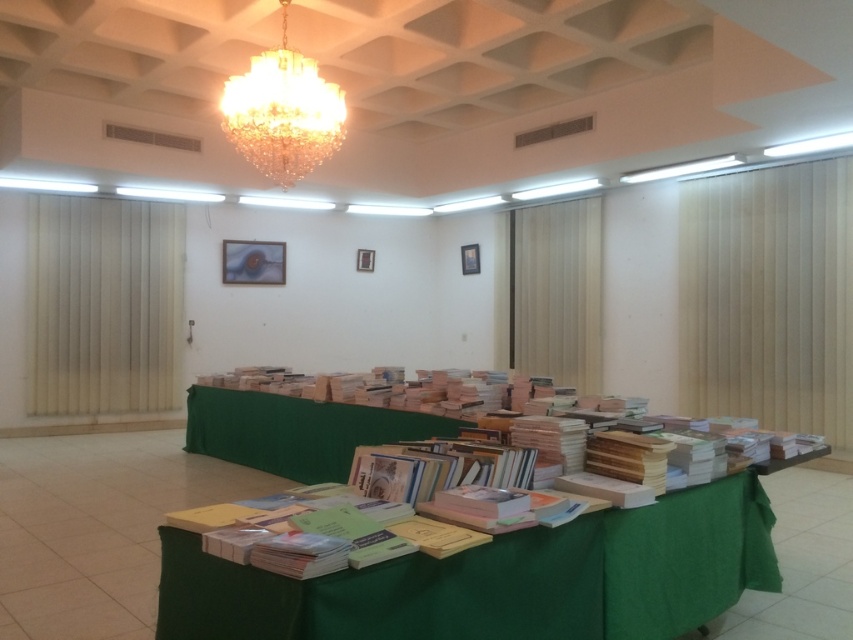
Is green fabric-covered table at center further to the viewer compared to beige fabric curtain at right?

No, it is not.

Who is lower down, green fabric-covered table at center or beige fabric curtain at right?

Positioned lower is green fabric-covered table at center.

Identify the location of green fabric-covered table at center. The height and width of the screenshot is (640, 853). (502, 579).

I want to click on green fabric-covered table at center, so click(502, 579).

Describe the element at coordinates (103, 305) in the screenshot. The height and width of the screenshot is (640, 853). I see `white/textured curtain at left` at that location.

Who is positioned more to the right, white/textured curtain at left or wooden curtain at center?

wooden curtain at center

Which is behind, point (143, 328) or point (520, 259)?

The point (520, 259) is behind.

The height and width of the screenshot is (640, 853). Identify the location of white/textured curtain at left. (103, 305).

Does beige fabric curtain at right have a greater height compared to crystal at upper center?

Correct, beige fabric curtain at right is much taller as crystal at upper center.

Can you confirm if beige fabric curtain at right is bigger than crystal at upper center?

Correct, beige fabric curtain at right is larger in size than crystal at upper center.

Which is in front, point (683, 384) or point (288, 77)?

Point (288, 77) is in front.

The height and width of the screenshot is (640, 853). I want to click on beige fabric curtain at right, so click(769, 296).